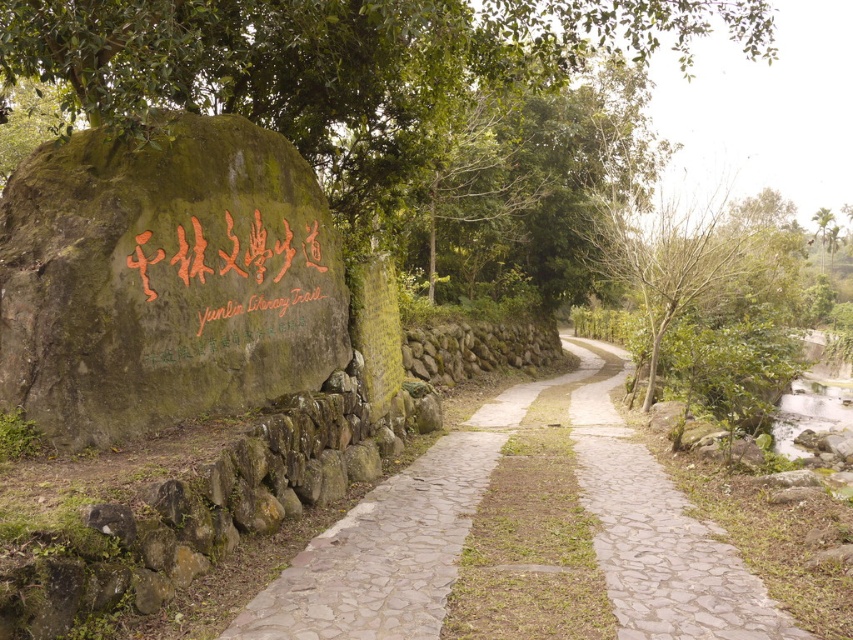
Measure the distance between point (198, 272) and camera.

Point (198, 272) and camera are 6.57 meters apart from each other.

This screenshot has height=640, width=853. What are the coordinates of `green mossy rock at left` in the screenshot? It's located at (164, 280).

This screenshot has width=853, height=640. What are the coordinates of `green mossy rock at left` in the screenshot? It's located at (164, 280).

Who is more forward, (x=62, y=22) or (x=704, y=620)?

Point (x=704, y=620) is more forward.

Between point (308, 150) and point (379, 534), which one is positioned behind?

Positioned behind is point (308, 150).

In order to click on green leafy tree at upper center in this screenshot , I will do coord(337,64).

Can you confirm if green mossy rock at left is smaller than green leafy tree at upper center?

Yes.

Based on the photo, measure the distance between green mossy rock at left and green leafy tree at upper center.

green mossy rock at left is 2.97 meters away from green leafy tree at upper center.

Which is behind, point (125, 196) or point (491, 68)?

The point (491, 68) is more distant.

Where is `green mossy rock at left`? Image resolution: width=853 pixels, height=640 pixels. green mossy rock at left is located at coordinates (164, 280).